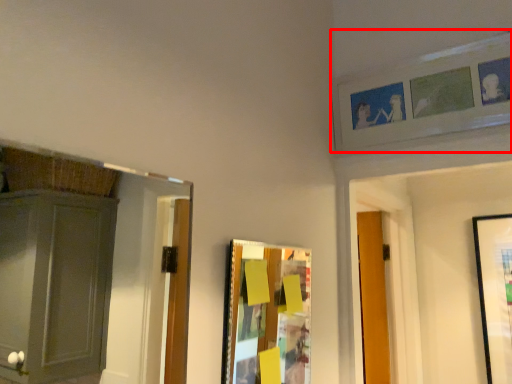
Question: In this image, where is picture frame (annotated by the red box) located relative to picture frame?

Choices:
 (A) right
 (B) left

Answer: (A)